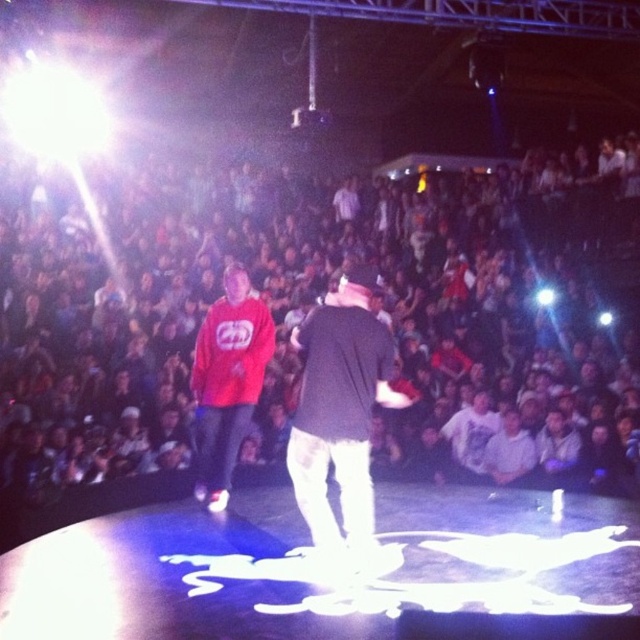
Question: Can you confirm if dark clothing audience at center is thinner than black matte jacket at center?

Choices:
 (A) yes
 (B) no

Answer: (B)

Question: Which of the following is the closest to the observer?

Choices:
 (A) dark clothing audience at center
 (B) black matte jacket at center

Answer: (B)

Question: Can you confirm if dark clothing audience at center is positioned above matte red hoodie at center?

Choices:
 (A) no
 (B) yes

Answer: (B)

Question: Based on their relative distances, which object is farther from the black matte jacket at center?

Choices:
 (A) matte red hoodie at center
 (B) dark clothing audience at center

Answer: (B)

Question: Among these points, which one is farthest from the camera?

Choices:
 (A) (228, 273)
 (B) (566, 392)

Answer: (B)

Question: Is black matte jacket at center above matte red hoodie at center?

Choices:
 (A) no
 (B) yes

Answer: (B)